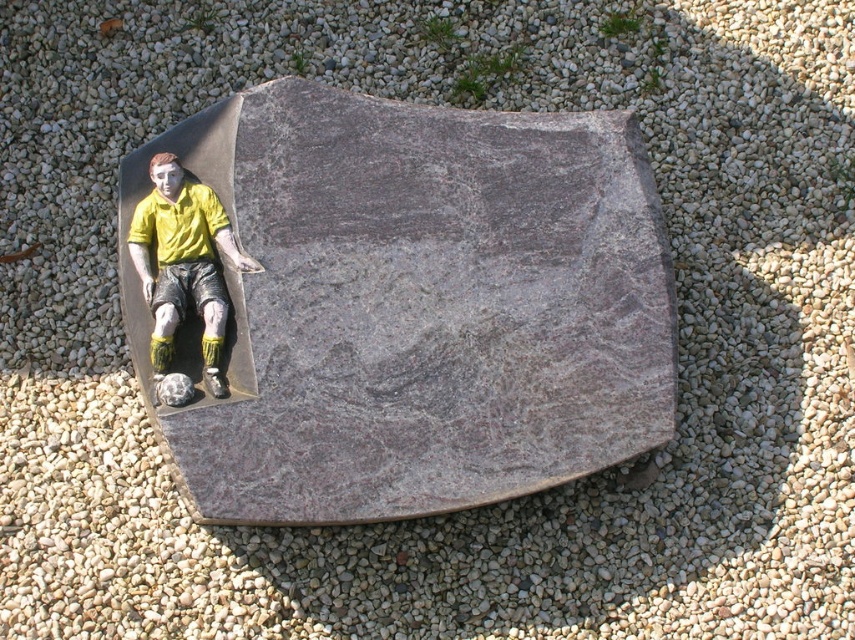
You are standing in front of the sculpture and want to touch both the granite stone at upper left and the matte yellow shirt at center. Which object should you reach for first to touch the one closer to you?

The granite stone at upper left is closer to the viewer than the matte yellow shirt at center, so you should reach for the granite stone at upper left first.

You are standing at the camera position and want to place a 1.80 meter long pole horizontally on the ground so that it points directly towards the point at coordinates (443, 422). Will the pole reach that point?

The point at coordinates (443, 422) is 2.70 meters away from the camera. Since the pole is 1.80 meters long, it will not reach the point as it is shorter than the distance required.